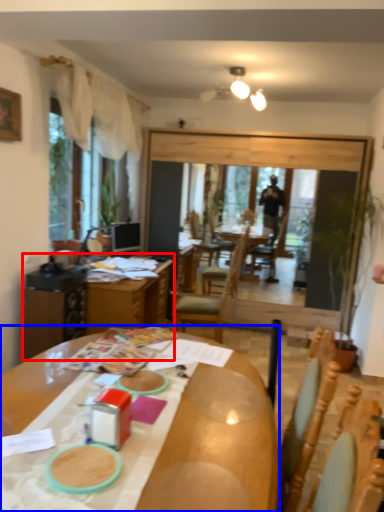
Question: Which object is closer to the camera taking this photo, table (highlighted by a red box) or desk (highlighted by a blue box)?

Choices:
 (A) table
 (B) desk

Answer: (B)